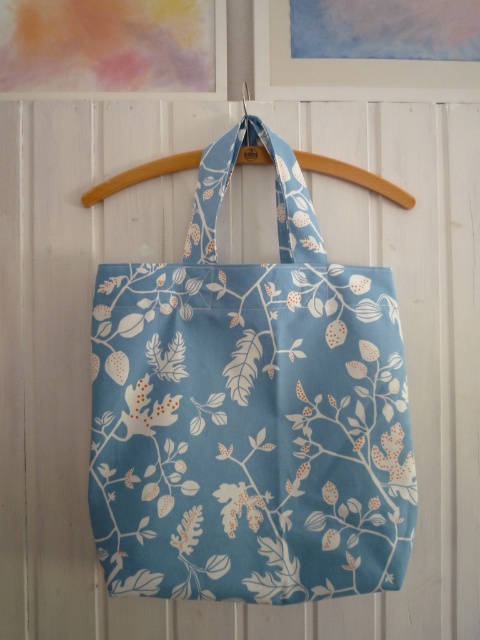
You are an interior designer arranging items on a wall. You have a light blue fabric tote at center and a wooden hanger at center. If you want to place a decorative item between them, which object should the item be placed closer to based on their widths?

The light blue fabric tote at center is narrower than the wooden hanger at center. Therefore, the decorative item should be placed closer to the wooden hanger at center to maintain balance between the two objects.

You are a delivery person who needs to hang a new tote bag on a hanger. The new tote has a width of 10 inches. Based on the image, will the wooden hanger at center be able to accommodate the light blue fabric tote at center without overlapping?

The distance between the light blue fabric tote at center and wooden hanger at center is 9.81 inches. Since the new tote is 10 inches wide, it will overlap slightly with the wooden hanger at center as the available space is less than the tote width.

You are an interior designer planning to place a decorative item on a shelf. The shelf has a coordinate system where the bottom left corner is the origin point. The shelf is 1.2 meters wide and 0.8 meters tall. The light blue fabric tote at center is placed at coordinate point 0.645, 0.521. If you want to place a small vase exactly 0.1 meters to the right and 0.05 meters above the tote, will the vase fit on the shelf without going over the edges?

The vase will fit on the shelf. The new coordinates would be 0.645m plus 0.1m equals 0.745m horizontally and 0.521m plus 0.05m equals 0.571m vertically. Since the shelf is 1.2m wide and 0.8m tall, both coordinates are within the shelf dimensions.